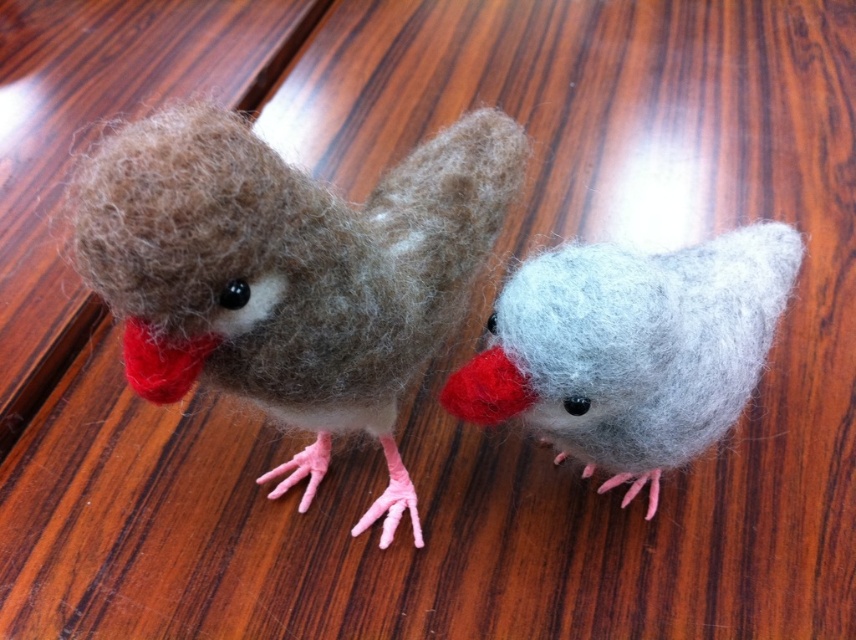
You are organizing a display of handmade felted birds. You need to place a new bird between the fuzzy brown bird at left and the light gray felt bird at center. Where should you position it?

You should place the new bird between the fuzzy brown bird at left and the light gray felt bird at center, positioning it to the right of the fuzzy brown bird at left and to the left of the light gray felt bird at center since the fuzzy brown bird at left is already to the left of the light gray felt bird at center.

From the picture: You are a child looking at the two birds on the wooden surface. You want to touch the matte red beak at center without touching the fuzzy brown bird at left. Is this possible?

The fuzzy brown bird at left is in front of the matte red beak at center, so you cannot reach the matte red beak at center without touching the fuzzy brown bird at left.